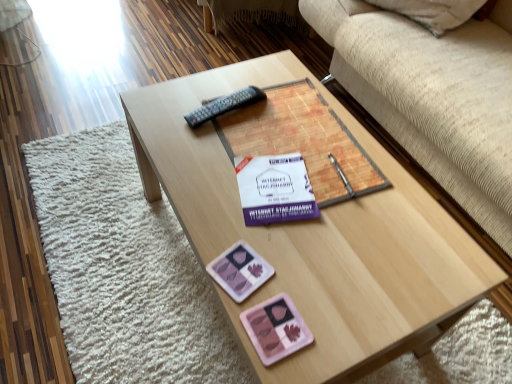
The image size is (512, 384). I want to click on free space behind pink plastic at lower center, which is the second currency in bottom-to-top order, so click(227, 220).